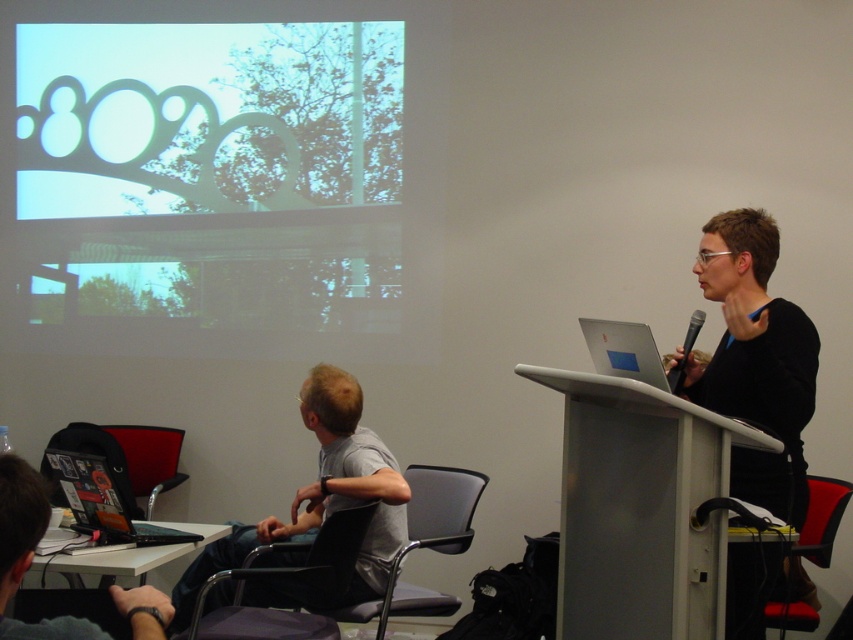
You are an attendee at the presentation and want to determine the relative positions of two points marked on the slide. The points are labeled as point [260,625] and point [111,484]. Which point is closer to the front of the slide?

Point [260,625] is in front of point [111,484], so it is closer to the front of the slide.

You are organizing a small workshop and need to place a 4.5 feet long table between the black fabric chair at lower center and the red fabric chair at lower right. Based on the image, will the table fit between them?

The distance between the black fabric chair at lower center and the red fabric chair at lower right is 4.47 feet, which is slightly shorter than the table length of 4.5 feet. Therefore, the table will not fit comfortably between them.

You are a photographer in the conference room and want to take a closeup shot of the gray fabric shirt at lower left. What coordinates should you aim your camera at?

The gray fabric shirt at lower left is located at point (318, 506), so aim your camera there.